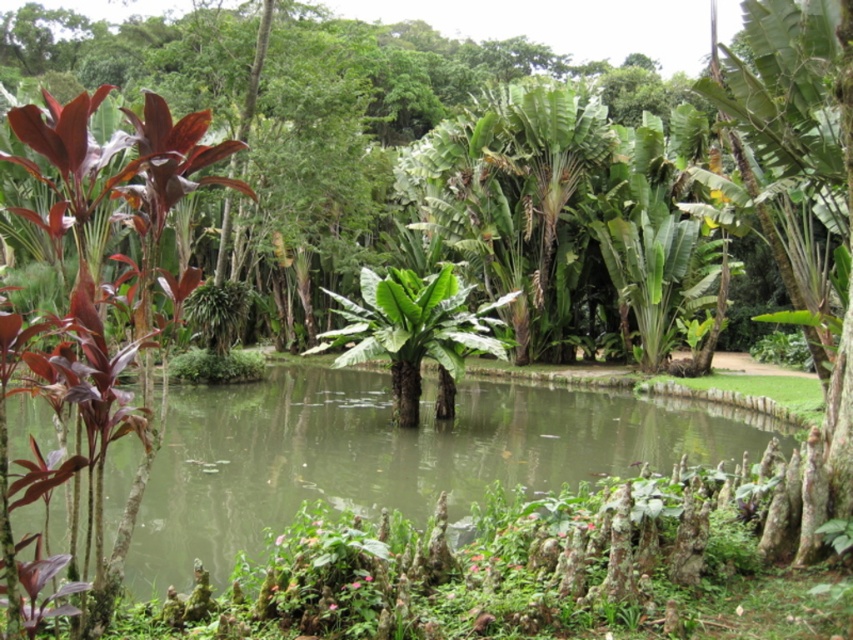
You are a gardener who wants to place a small statue in the garden. You have two options for placement based on the scene. The first option is near the shiny burgundy leaf at left, and the second is near the green murky water at center. Which location is farther to the right?

The green murky water at center is to the right of the shiny burgundy leaf at left, so placing the statue near the green murky water at center would be farther to the right.

You are a gardener who wants to place a small statue in the garden. You have two options for placement. One is near the green murky water at center, and the other is near the shiny burgundy leaf at left. Which location has a lower height and would be better for a statue that needs to be seen from a distance?

The green murky water at center has a lesser height compared to the shiny burgundy leaf at left, so placing the statue near the green murky water at center would be better as it is lower and more visible from a distance.

You are a gardener standing at the edge of the pond. You notice the shiny burgundy leaf at left and the green murky water at center. Which object is closer to you?

The green murky water at center is closer to you because the shiny burgundy leaf at left is behind it.